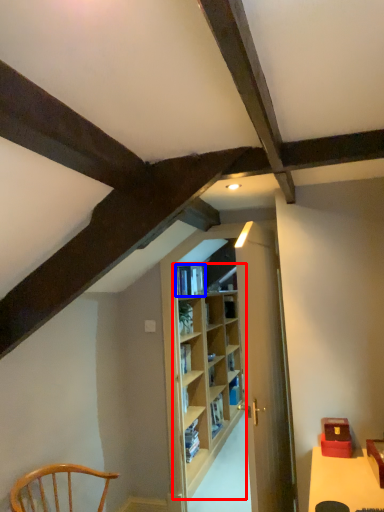
Question: Which object is further to the camera taking this photo, shelf (highlighted by a red box) or book (highlighted by a blue box)?

Choices:
 (A) shelf
 (B) book

Answer: (B)